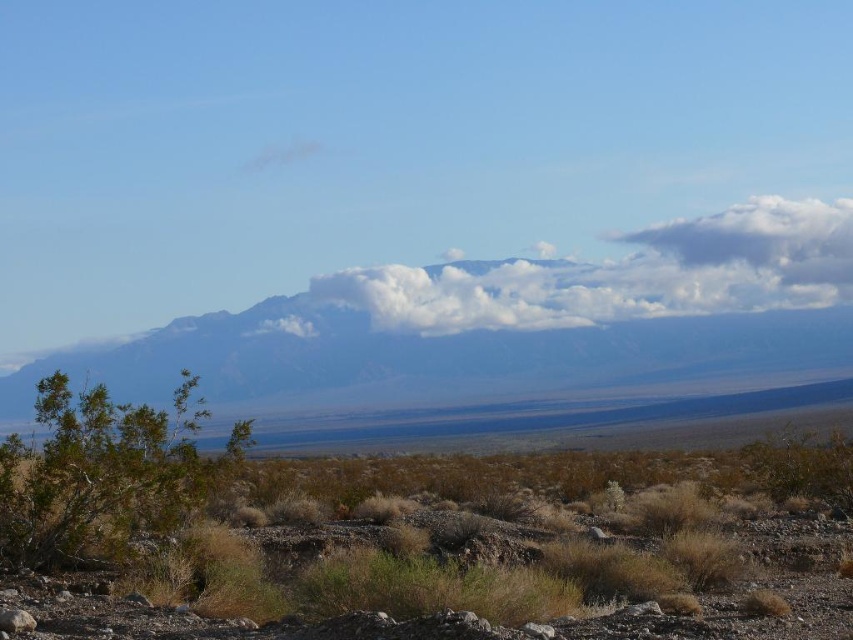
You are standing in the desert and see the white fluffy cloud at center and the green leafy bush at lower left. Which object is positioned to the right when looking at them from your current viewpoint?

The white fluffy cloud at center is positioned to the right of the green leafy bush at lower left.

You are standing in the desert and want to reach the point marked at coordinates (x=729, y=563). If your walking speed is 5 meters per minute, how long will it take you to reach that point?

The point marked at coordinates (x=729, y=563) is 15.46 meters away from you. At a walking speed of 5 meters per minute, it will take approximately 3.09 minutes to reach the point.

You are standing at the center of the desert scene. You see the brown dry grass at lower left. Which direction should you walk to reach it?

The brown dry grass at lower left is located at point (480, 554) in 2D coordinates, so you should walk towards the lower left direction to reach it.